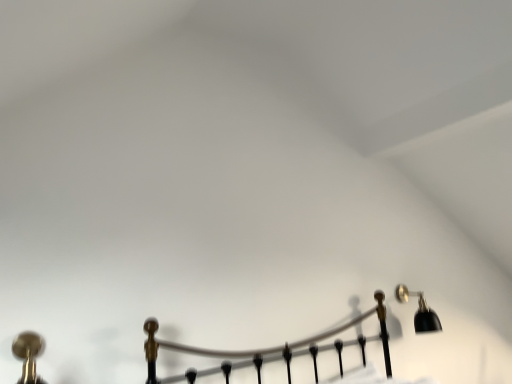
The width and height of the screenshot is (512, 384). What do you see at coordinates (419, 311) in the screenshot?
I see `black matte wall lamp at upper right` at bounding box center [419, 311].

In order to click on black matte wall lamp at upper right in this screenshot , I will do `click(419, 311)`.

Identify the location of black matte wall lamp at upper right. (419, 311).